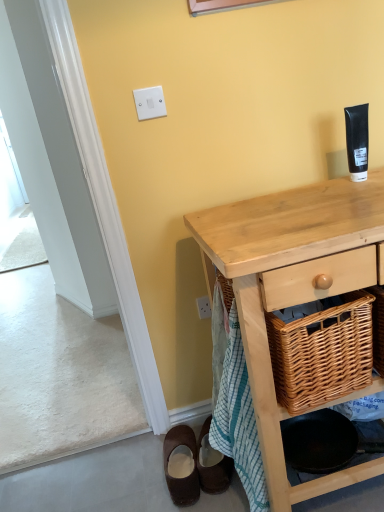
Question: Visually, is brown suede shoes at lower left, placed as the 2th footwear when sorted from left to right, positioned to the left or to the right of woven wood picnic basket at lower right?

Choices:
 (A) left
 (B) right

Answer: (A)

Question: Is point (216, 467) positioned closer to the camera than point (332, 390)?

Choices:
 (A) farther
 (B) closer

Answer: (A)

Question: Which object is positioned farthest from the natural wood desk at center?

Choices:
 (A) white plastic light switch at upper center
 (B) woven wood picnic basket at lower right
 (C) brown suede shoes at lower left, the 1th footwear positioned from the right
 (D) black matte tube at upper right
 (E) brown suede mule at lower left, the 2th footwear when ordered from right to left

Answer: (E)

Question: Estimate the real-world distances between objects in this image. Which object is farther from the black matte tube at upper right?

Choices:
 (A) woven wood picnic basket at lower right
 (B) natural wood desk at center
 (C) brown suede shoes at lower left, the 1th footwear positioned from the right
 (D) white plastic light switch at upper center
 (E) brown suede mule at lower left, the 2th footwear when ordered from right to left

Answer: (E)